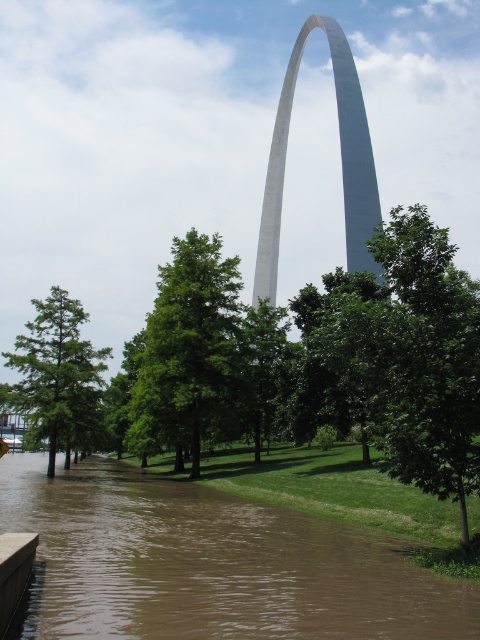
You are standing at the base of the Gateway Arch and notice the brown muddy water at lower left. Based on its position, can you determine if it is closer to you or further away compared to the arch?

The brown muddy water at lower left is located at point coordinates which place it closer to the viewer than the Gateway Arch, as lower left positions in images typically indicate foreground elements.

You are a visitor at the Gateway Arch National Park. You notice the brown muddy water at lower left and the white polished stone arch at center. Which object appears taller in the image?

The white polished stone arch at center appears taller than the brown muddy water at lower left.

You are a tourist visiting the Gateway Arch and want to take a photo that includes both the brown muddy water at lower left and the white polished stone arch at center. Based on their positions, which object should appear to the left in your photo?

The brown muddy water at lower left is positioned on the left side of the white polished stone arch at center, so in the photo, the brown muddy water at lower left will appear to the left of the white polished stone arch at center.